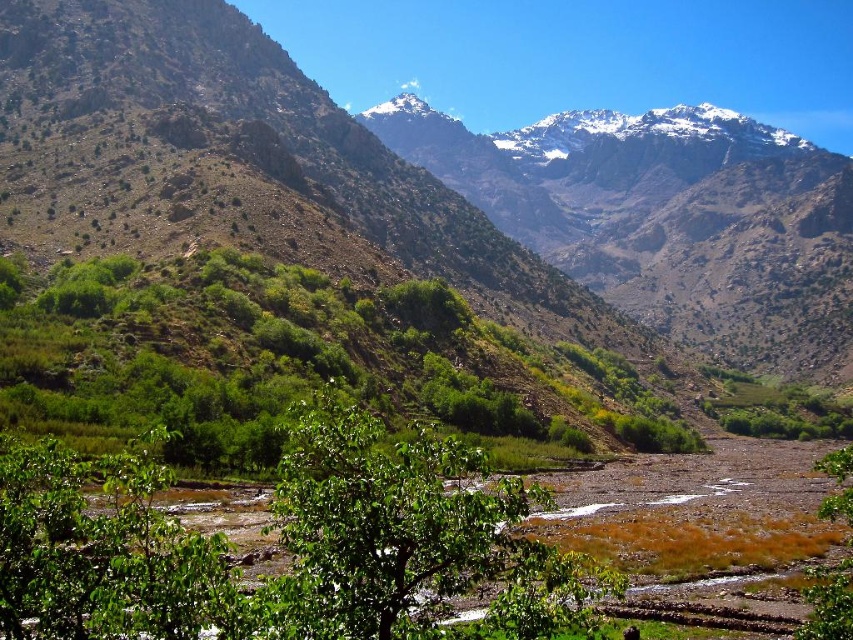
Measure the distance between green leafy tree at center and green leafy tree at lower right.

green leafy tree at center and green leafy tree at lower right are 81.55 meters apart.

Between green leafy tree at center and green leafy tree at lower right, which one appears on the right side from the viewer's perspective?

green leafy tree at lower right

Which is in front, point (695, 432) or point (804, 628)?

Point (804, 628) is more forward.

What are the coordinates of `green leafy tree at center` in the screenshot? It's located at (x=299, y=362).